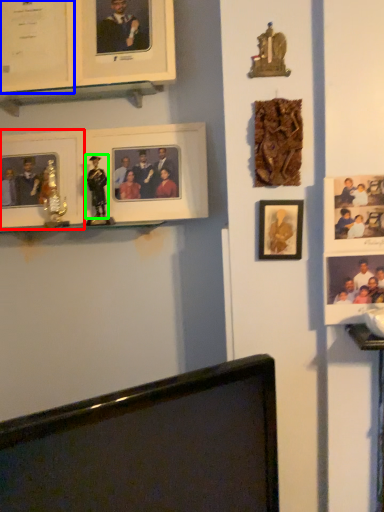
Question: Which is farther away from picture frame (highlighted by a red box)? picture frame (highlighted by a blue box) or person (highlighted by a green box)?

Choices:
 (A) picture frame
 (B) person

Answer: (A)